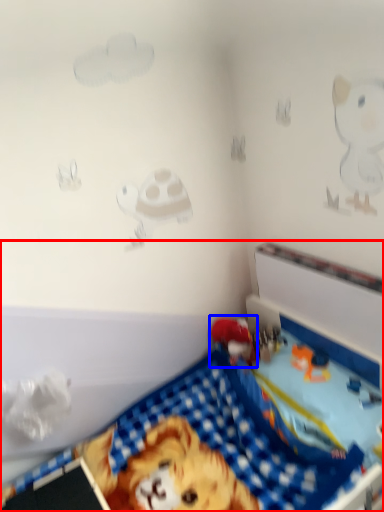
Question: Which of the following is the farthest to the observer, toy (highlighted by a red box) or toy (highlighted by a blue box)?

Choices:
 (A) toy
 (B) toy

Answer: (B)